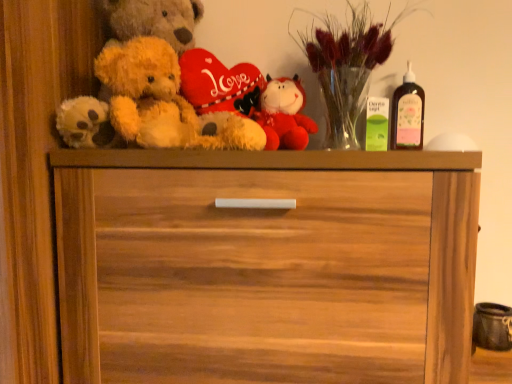
Question: Would you say wooden chest of drawers at center is a long distance from fluffy red plush toy at center?

Choices:
 (A) no
 (B) yes

Answer: (A)

Question: Considering the relative sizes of wooden chest of drawers at center and fluffy red plush toy at center in the image provided, is wooden chest of drawers at center smaller than fluffy red plush toy at center?

Choices:
 (A) no
 (B) yes

Answer: (A)

Question: From a real-world perspective, is wooden chest of drawers at center on fluffy red plush toy at center?

Choices:
 (A) yes
 (B) no

Answer: (B)

Question: From the image's perspective, is wooden chest of drawers at center on fluffy red plush toy at center?

Choices:
 (A) no
 (B) yes

Answer: (A)

Question: Is wooden chest of drawers at center positioned with its back to fluffy red plush toy at center?

Choices:
 (A) no
 (B) yes

Answer: (A)

Question: Considering the relative sizes of wooden chest of drawers at center and fluffy red plush toy at center in the image provided, is wooden chest of drawers at center bigger than fluffy red plush toy at center?

Choices:
 (A) yes
 (B) no

Answer: (A)

Question: Considering the relative positions of pink glass bottle at upper right and fluffy beige teddy bear at left in the image provided, is pink glass bottle at upper right behind fluffy beige teddy bear at left?

Choices:
 (A) no
 (B) yes

Answer: (B)

Question: Is the depth of pink glass bottle at upper right less than that of fluffy beige teddy bear at left?

Choices:
 (A) no
 (B) yes

Answer: (A)

Question: Is pink glass bottle at upper right to the right of fluffy beige teddy bear at left from the viewer's perspective?

Choices:
 (A) yes
 (B) no

Answer: (A)

Question: From a real-world perspective, does pink glass bottle at upper right sit lower than fluffy beige teddy bear at left?

Choices:
 (A) no
 (B) yes

Answer: (B)

Question: Could you tell me if pink glass bottle at upper right is turned towards fluffy beige teddy bear at left?

Choices:
 (A) no
 (B) yes

Answer: (A)

Question: Can you confirm if pink glass bottle at upper right is bigger than fluffy beige teddy bear at left?

Choices:
 (A) yes
 (B) no

Answer: (B)

Question: Is wooden chest of drawers at center in front of pink glass bottle at upper right?

Choices:
 (A) no
 (B) yes

Answer: (B)